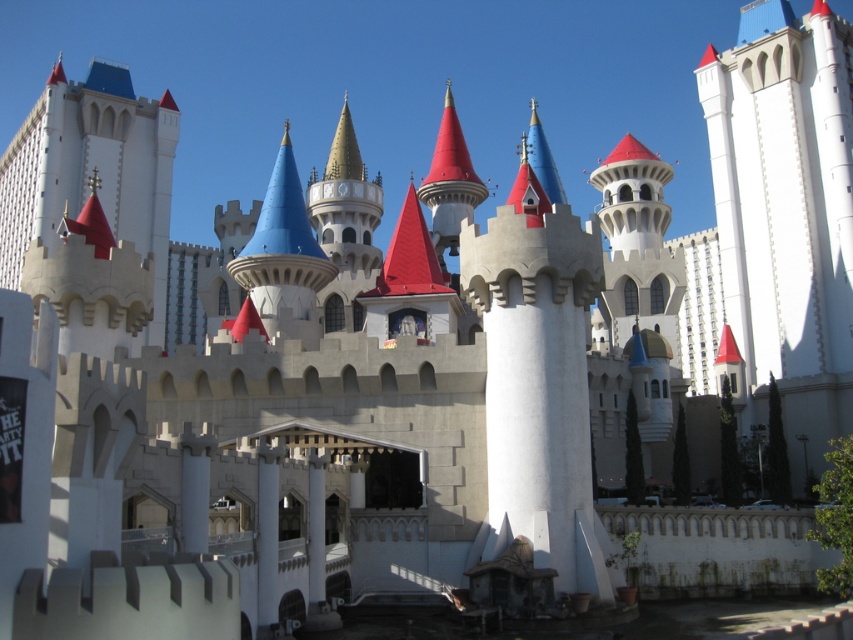
Is white stone tower at upper right positioned behind white stone castle at upper left?

Yes, it is behind white stone castle at upper left.

Which is below, white stone tower at upper right or white stone castle at upper left?

white stone tower at upper right is lower down.

The width and height of the screenshot is (853, 640). Identify the location of white stone tower at upper right. (786, 212).